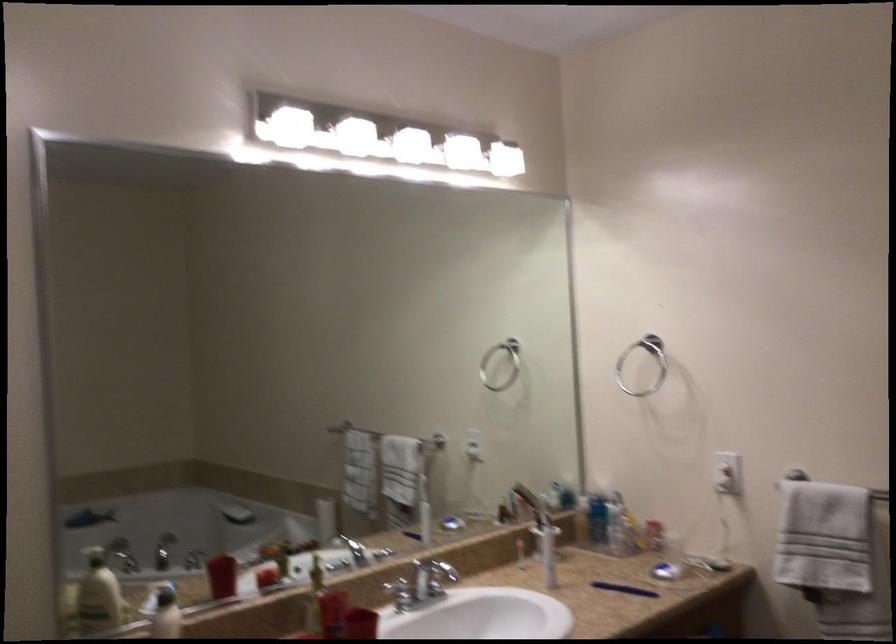
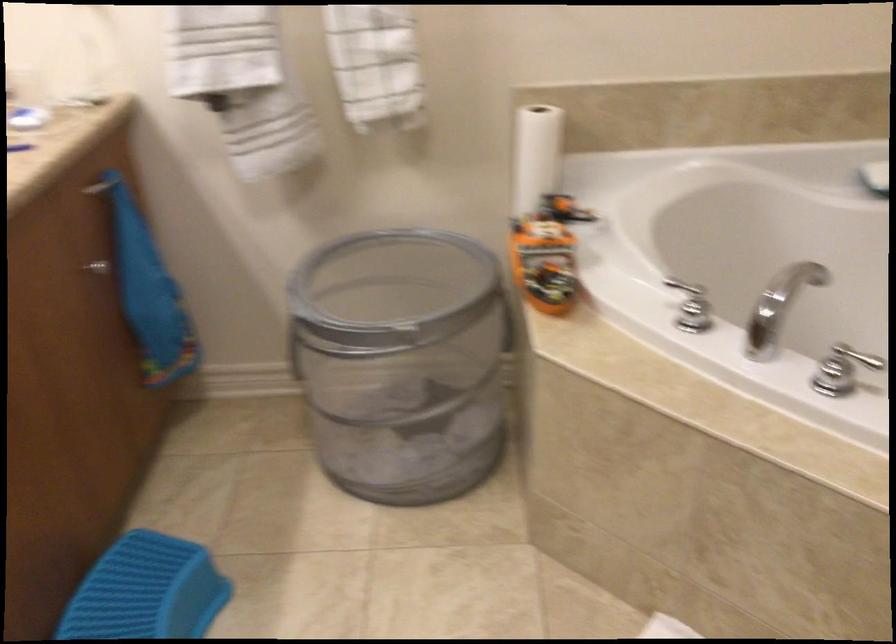
How did the camera likely rotate?

The camera's rotation is toward right-down.